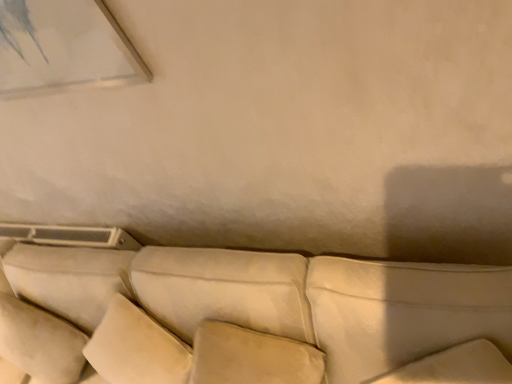
Question: Looking at their shapes, would you say white leather pillow at lower right, which ranks as the first pillow in right-to-left order, is wider or thinner than suede-like beige couch at center?

Choices:
 (A) thin
 (B) wide

Answer: (A)

Question: From a real-world perspective, is white leather pillow at lower right, which is counted as the 3th pillow, starting from the left, physically located above or below suede-like beige couch at center?

Choices:
 (A) below
 (B) above

Answer: (B)

Question: Estimate the real-world distances between objects in this image. Which object is farther from the suede-like beige pillow at center, the second pillow in the left-to-right sequence?

Choices:
 (A) beige suede pillow at lower left, marked as the 3th pillow in a right-to-left arrangement
 (B) suede-like beige couch at center
 (C) white leather pillow at lower right, which is counted as the 3th pillow, starting from the left

Answer: (A)

Question: Estimate the real-world distances between objects in this image. Which object is farther from the suede-like beige couch at center?

Choices:
 (A) beige suede pillow at lower left, marked as the 3th pillow in a right-to-left arrangement
 (B) suede-like beige pillow at center, the second pillow in the left-to-right sequence
 (C) white leather pillow at lower right, which ranks as the first pillow in right-to-left order

Answer: (A)